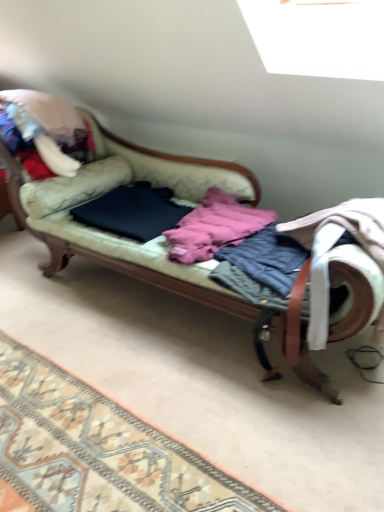
Question: Is patterned carpet at lower left situated inside velvet green couch at center or outside?

Choices:
 (A) outside
 (B) inside

Answer: (A)

Question: From a real-world perspective, is patterned carpet at lower left above or below velvet green couch at center?

Choices:
 (A) below
 (B) above

Answer: (A)

Question: Which object is positioned farthest from the patterned carpet at lower left?

Choices:
 (A) dark blue fabric at center, the third clothing when ordered from right to left
 (B) pink fleece jacket at center, marked as the second clothing in a right-to-left arrangement
 (C) blue quilted jacket at center, the third clothing when ordered from left to right
 (D) velvet green couch at center

Answer: (A)

Question: Considering the real-world distances, which object is farthest from the patterned carpet at lower left?

Choices:
 (A) velvet green couch at center
 (B) pink fleece jacket at center, the 2th clothing positioned from the left
 (C) dark blue fabric at center, the third clothing when ordered from right to left
 (D) blue quilted jacket at center, the first clothing viewed from the right

Answer: (C)